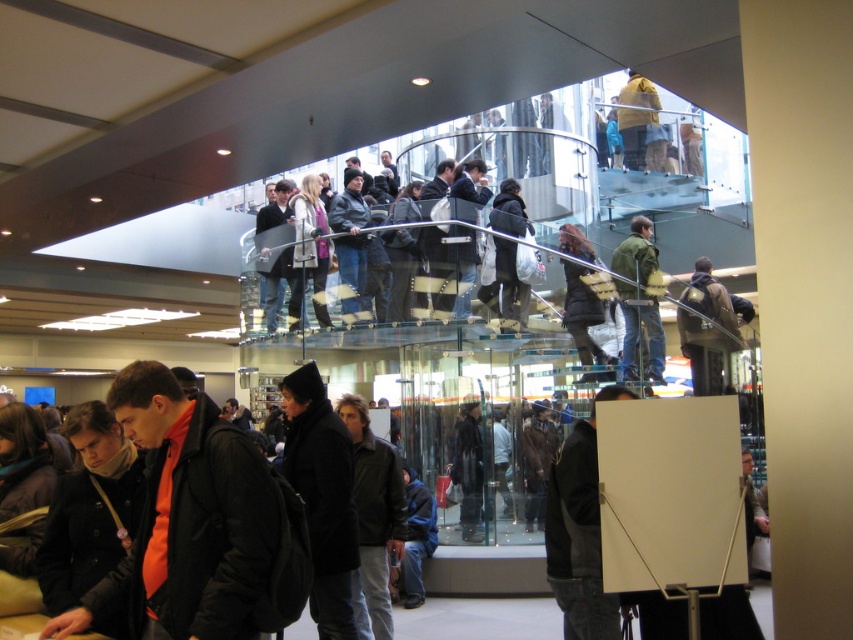
Is black matte jacket at center above green textured jacket at center?

No.

This screenshot has height=640, width=853. What do you see at coordinates (322, 497) in the screenshot? I see `black matte jacket at center` at bounding box center [322, 497].

Image resolution: width=853 pixels, height=640 pixels. What are the coordinates of `black matte jacket at center` in the screenshot? It's located at (322, 497).

Can you confirm if black matte jacket at center is taller than dark gray jacket at center?

Yes, black matte jacket at center is taller than dark gray jacket at center.

Based on the photo, who is more forward, (x=347, y=579) or (x=369, y=554)?

Point (x=347, y=579) is more forward.

I want to click on black matte jacket at center, so click(322, 497).

Where is `orange matte jacket at lower left`? The image size is (853, 640). orange matte jacket at lower left is located at coordinates (195, 513).

Does orange matte jacket at lower left appear on the left side of black matte jacket at center?

Correct, you'll find orange matte jacket at lower left to the left of black matte jacket at center.

Between point (120, 419) and point (321, 604), which one is positioned behind?

The point (321, 604) is behind.

Where is `orange matte jacket at lower left`? orange matte jacket at lower left is located at coordinates (195, 513).